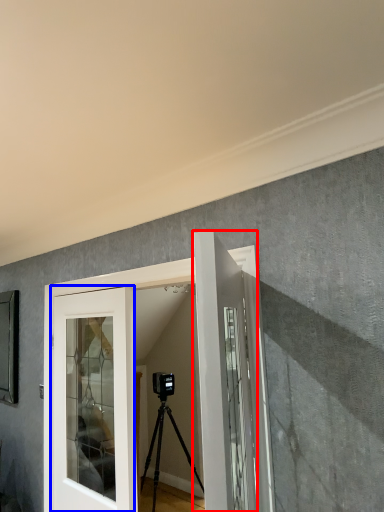
Question: Which point is further to the camera, door (highlighted by a red box) or door (highlighted by a blue box)?

Choices:
 (A) door
 (B) door

Answer: (B)